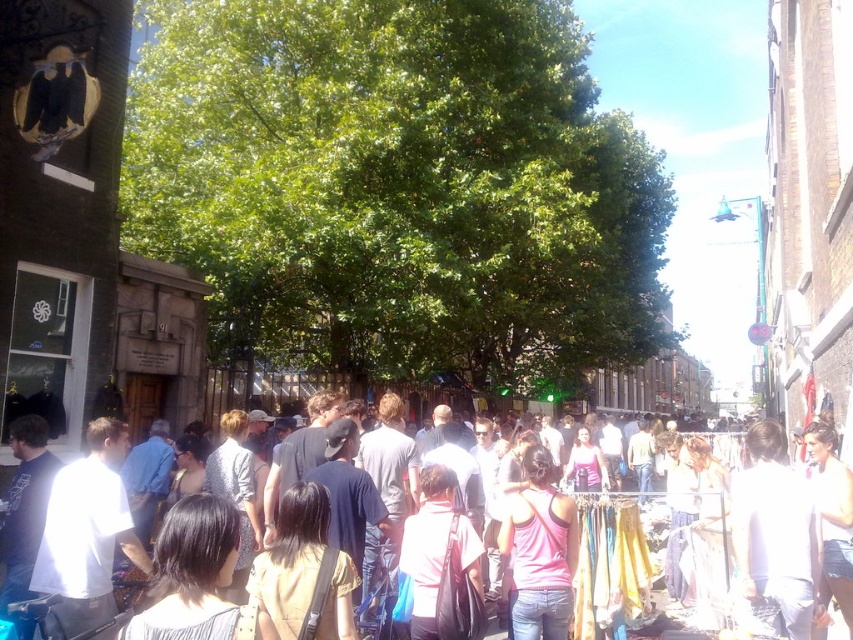
Question: Among these points, which one is farthest from the camera?

Choices:
 (A) (802, 445)
 (B) (416, 339)

Answer: (B)

Question: Can you confirm if green leafy tree at center is positioned above pink matte tank top at center?

Choices:
 (A) no
 (B) yes

Answer: (B)

Question: Which point is closer to the camera?

Choices:
 (A) (x=532, y=248)
 (B) (x=799, y=570)
 (C) (x=526, y=474)
 (D) (x=724, y=440)

Answer: (B)

Question: Does white matte shirt at right have a larger size compared to light brown leather jacket at center?

Choices:
 (A) yes
 (B) no

Answer: (B)

Question: Which object appears closest to the camera in this image?

Choices:
 (A) white matte shirt at right
 (B) green leafy tree at center

Answer: (A)

Question: Can you confirm if white matte shirt at right is positioned below pink matte tank top at center?

Choices:
 (A) no
 (B) yes

Answer: (B)